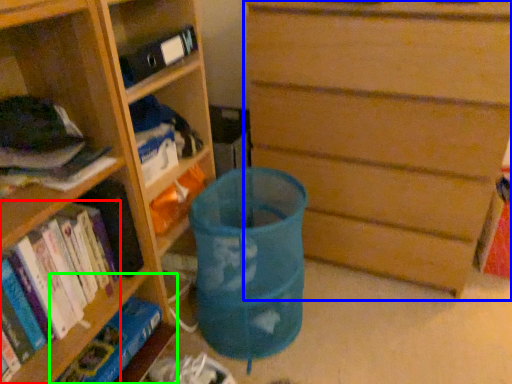
Question: Based on their relative distances, which object is nearer to book (highlighted by a red box)? Choose from chest of drawers (highlighted by a blue box) and shelf (highlighted by a green box).

Choices:
 (A) chest of drawers
 (B) shelf

Answer: (B)